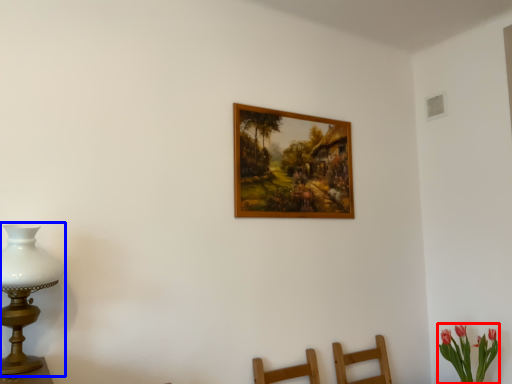
Question: Which object is further to the camera taking this photo, floral arrangement (highlighted by a red box) or table lamp (highlighted by a blue box)?

Choices:
 (A) floral arrangement
 (B) table lamp

Answer: (A)